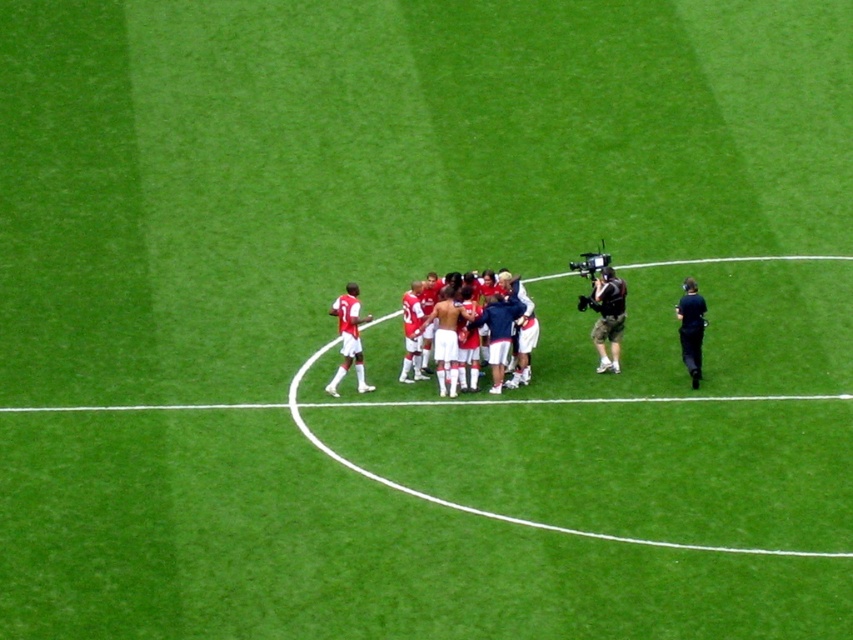
Between point (457, 320) and point (598, 340), which one is positioned behind?

Positioned behind is point (598, 340).

Does red matte soccer players at center have a greater width compared to camouflage-patterned shorts at center?

Yes.

Which is behind, point (447, 384) or point (608, 358)?

The point (608, 358) is more distant.

At what (x,y) coordinates should I click in order to perform the action: click on red matte soccer players at center. Please return your answer as a coordinate pair (x, y). The height and width of the screenshot is (640, 853). Looking at the image, I should click on (448, 314).

Measure the distance between point (358, 352) and camera.

19.21 meters

Identify the location of matte white shorts at center. This screenshot has height=640, width=853. [349, 339].

Is camouflage-patterned shorts at center to the left of matte white shorts at center from the viewer's perspective?

No, camouflage-patterned shorts at center is not to the left of matte white shorts at center.

This screenshot has width=853, height=640. What are the coordinates of `camouflage-patterned shorts at center` in the screenshot? It's located at (606, 317).

This screenshot has width=853, height=640. What are the coordinates of `camouflage-patterned shorts at center` in the screenshot? It's located at (606, 317).